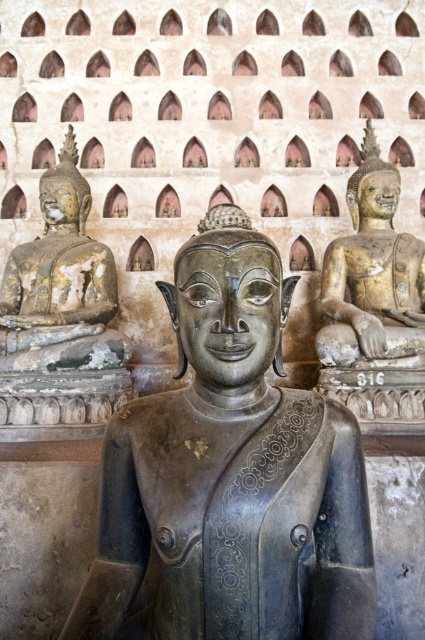
Question: In this image, where is bronze statue at center located relative to gold-bronze statue at right?

Choices:
 (A) right
 (B) left

Answer: (B)

Question: Which of the following is the farthest from the observer?

Choices:
 (A) (319, 604)
 (B) (396, 300)

Answer: (B)

Question: Is bronze statue at center wider than gold-bronze statue at right?

Choices:
 (A) yes
 (B) no

Answer: (A)

Question: Is the position of bronze statue at center less distant than that of gold-bronze statue at right?

Choices:
 (A) yes
 (B) no

Answer: (A)

Question: Which of the following is the closest to the observer?

Choices:
 (A) bronze statue at center
 (B) gold-bronze statue at right

Answer: (A)